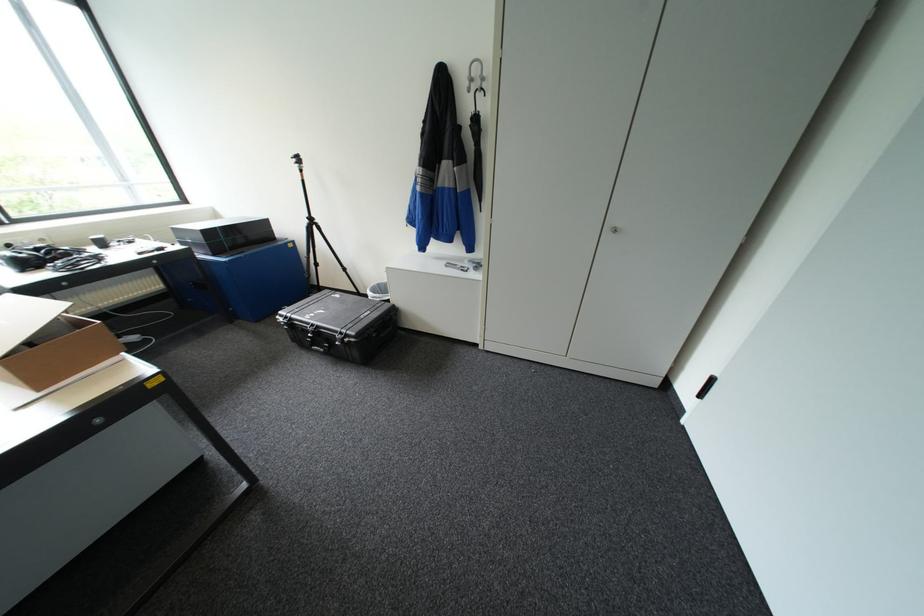
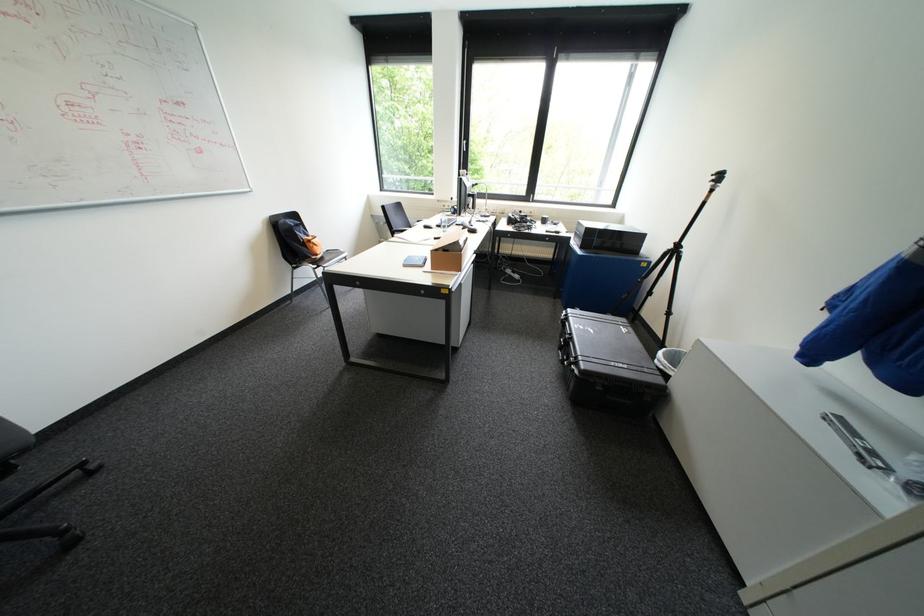
Find the pixel in the second image that matches (395,304) in the first image.

(666, 379)